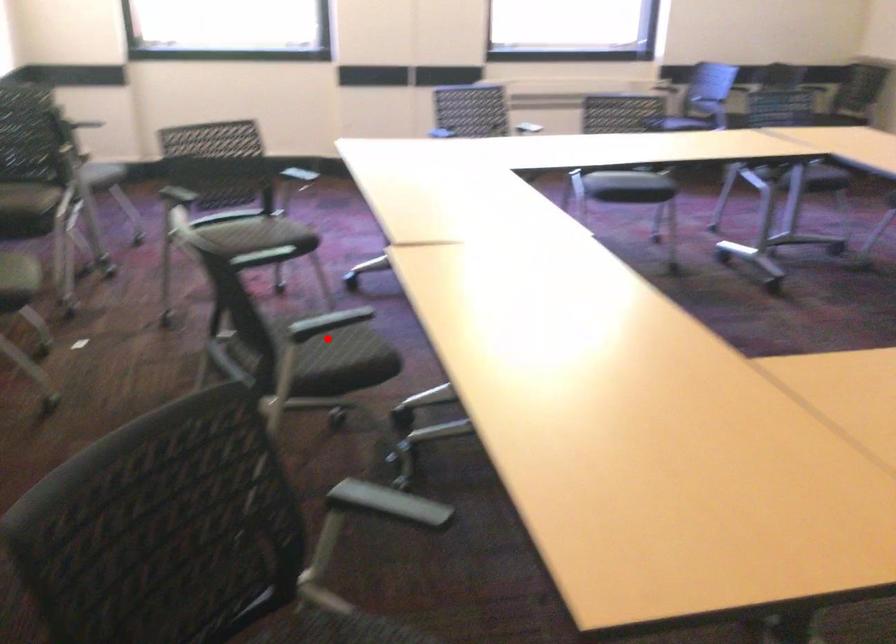
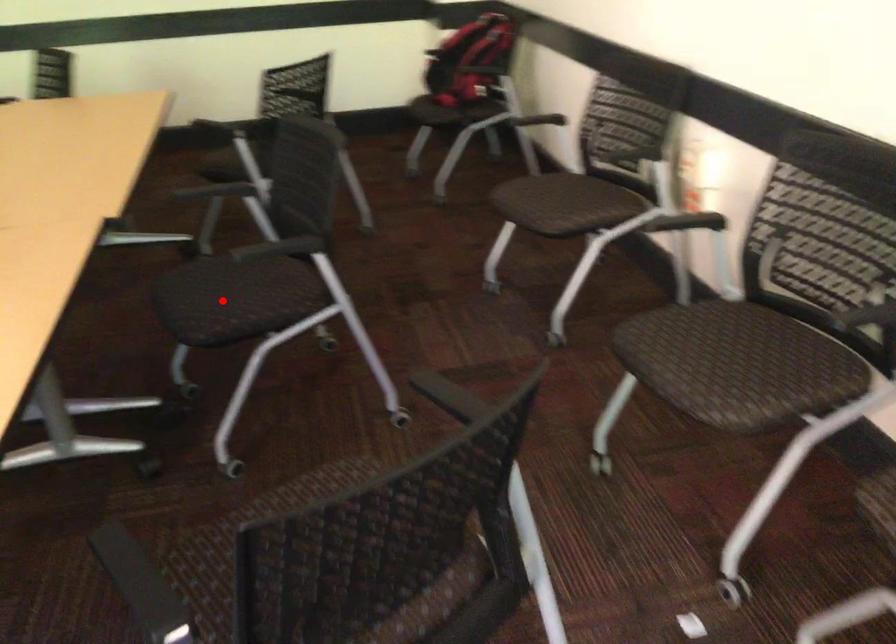
I am providing you with two images of the same scene from different viewpoints. A red point is marked on the first image and another point is marked on the second image. Is the marked point in image1 the same physical position as the marked point in image2?

Yes